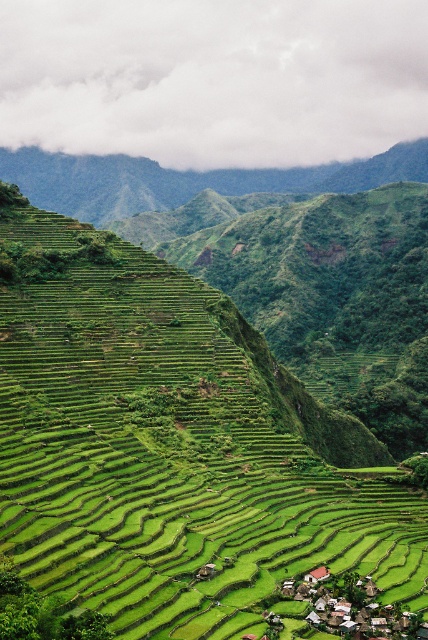
Question: Is green grassy terraces at center thinner than white wooden houses at bottom right?

Choices:
 (A) yes
 (B) no

Answer: (B)

Question: Is green grassy terraces at center to the left of white wooden houses at bottom right from the viewer's perspective?

Choices:
 (A) no
 (B) yes

Answer: (B)

Question: Is green grassy terraces at center smaller than white wooden houses at bottom right?

Choices:
 (A) yes
 (B) no

Answer: (B)

Question: Which of the following is the closest to the observer?

Choices:
 (A) white wooden houses at bottom right
 (B) green grassy terraces at center

Answer: (B)

Question: Which object appears closest to the camera in this image?

Choices:
 (A) green grassy terraces at center
 (B) white wooden houses at bottom right

Answer: (A)

Question: Which point is farther to the camera?

Choices:
 (A) white wooden houses at bottom right
 (B) green grassy terraces at center

Answer: (A)